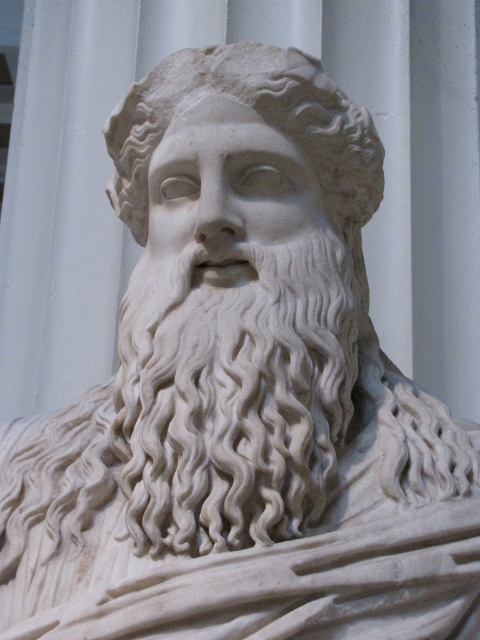
Between white marble beard at center and white marble head at center, which one has more height?

white marble beard at center is taller.

In the scene shown: Does white marble beard at center have a greater height compared to white marble head at center?

Indeed, white marble beard at center has a greater height compared to white marble head at center.

Identify the location of white marble beard at center. Image resolution: width=480 pixels, height=640 pixels. (233, 396).